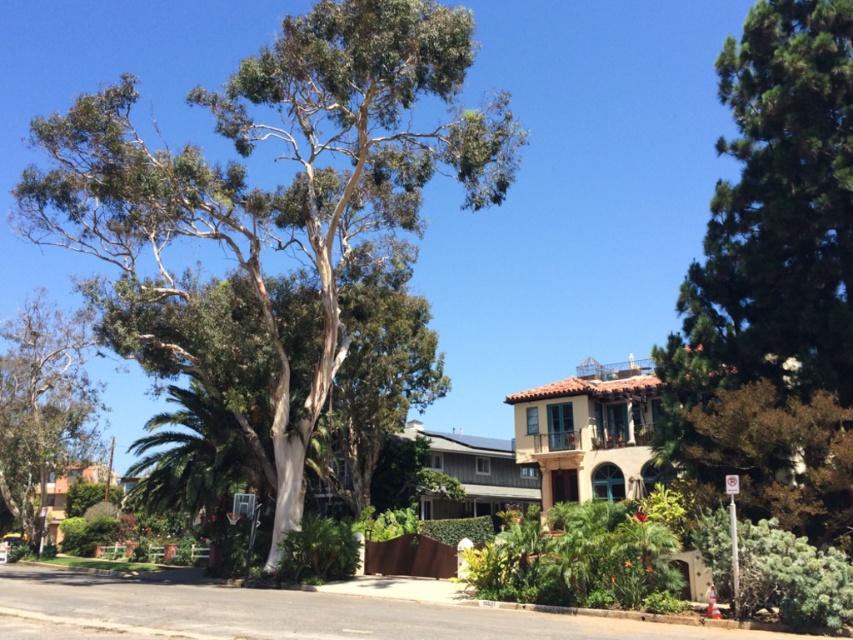
Based on the scene description, which tree has a larger width between the green leafy tree at upper left and the green textured tree at upper right?

The green leafy tree at upper left is wider than the green textured tree at upper right according to the description.

You are a bird flying over the suburban street scene. You want to land on the highest point between the green textured tree at upper right and the green leafy tree at center. Which tree should you choose?

The green textured tree at upper right is above the green leafy tree at center, so you should choose the green textured tree at upper right to land on as it is the higher option.

You are a bird looking for a nesting spot. You see the green textured tree at upper right and the green leafy tree at center. Which tree has a thicker trunk for a more stable nest?

The green leafy tree at center has a thicker trunk than the green textured tree at upper right, making it a better choice for a stable nest.